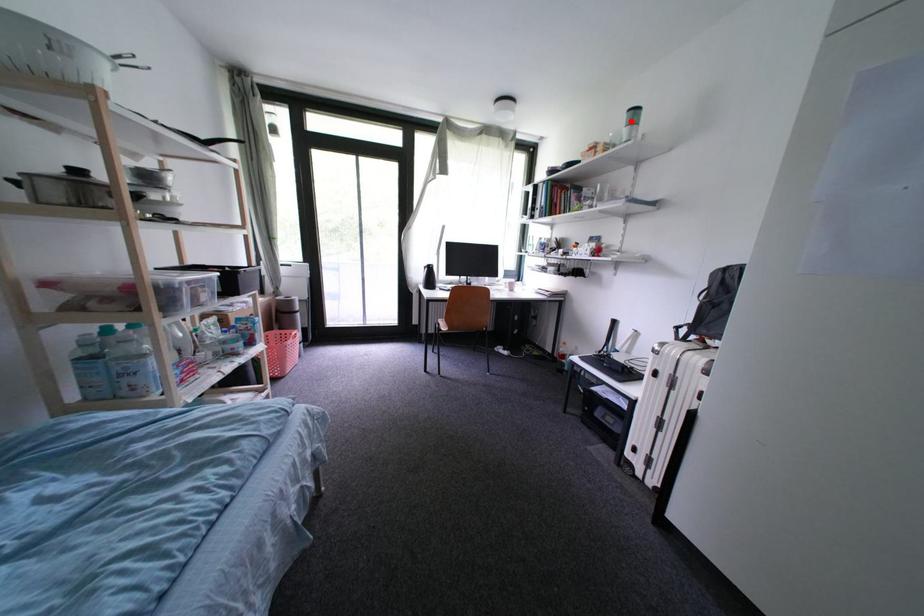
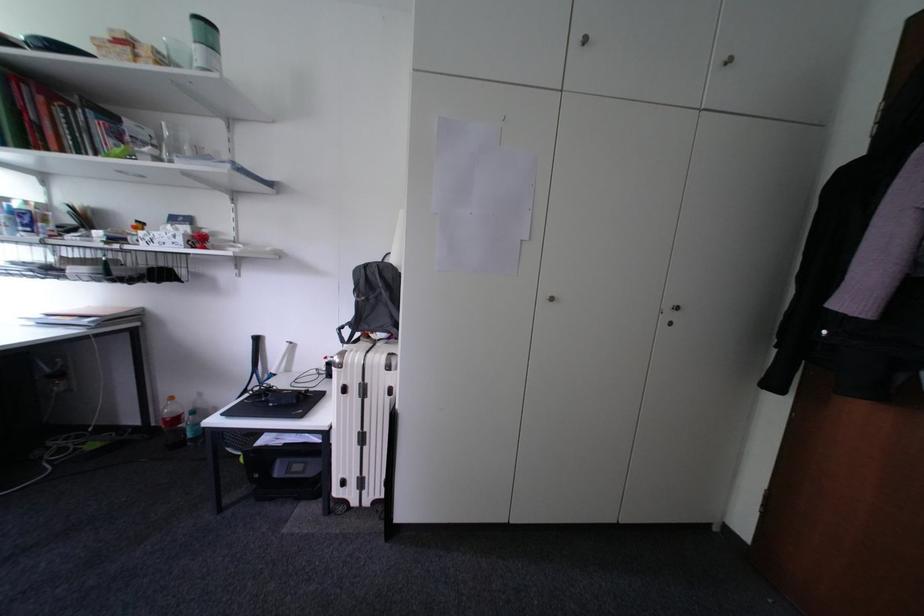
Locate, in the second image, the point that corresponds to the highlighted location in the first image.

(193, 26)